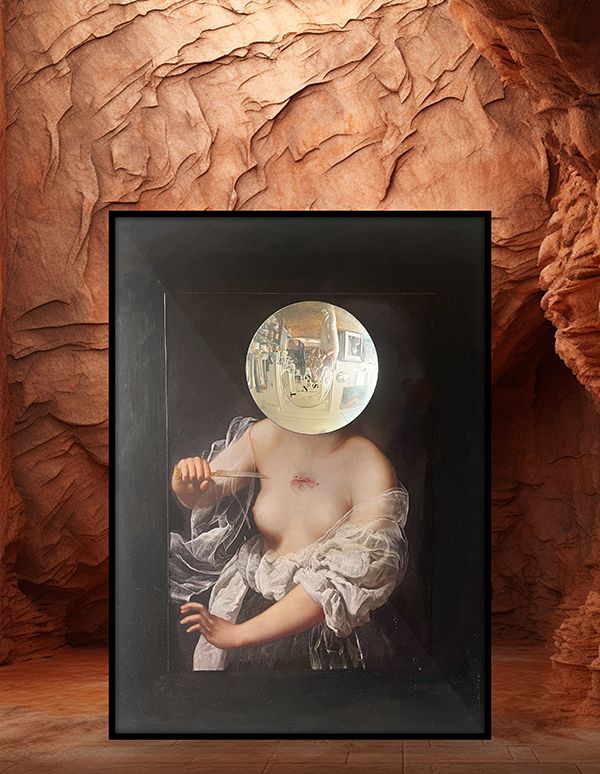
You are a GUI agent. You are given a task and a screenshot of the screen. Output one action in this format:
    pyautogui.click(x=<x>, y=<y>)
    Task: Click on the painting
    
    Given the screenshot: What is the action you would take?
    [191, 409]